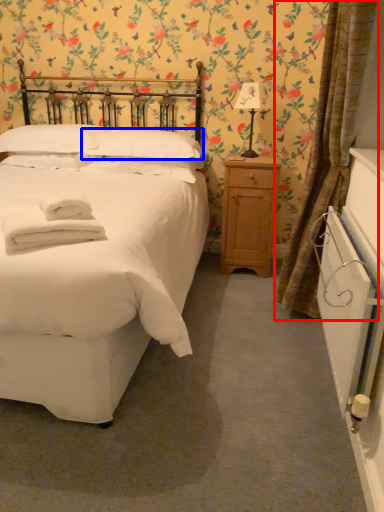
Question: Which of the following is the closest to the observer, curtain (highlighted by a red box) or pillow (highlighted by a blue box)?

Choices:
 (A) curtain
 (B) pillow

Answer: (A)